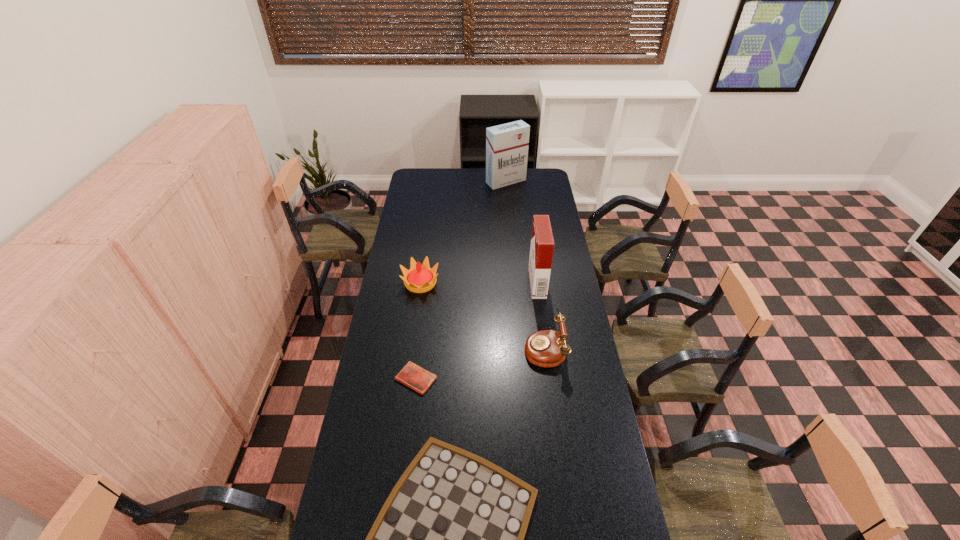
I want to click on vacant point located on the dial of the telephone, so click(474, 348).

Locate an element on the screen. This screenshot has width=960, height=540. vacant space located 0.180m on the dial of the telephone is located at coordinates (480, 348).

Where is `free region located 0.370m on the back of the crown`? The width and height of the screenshot is (960, 540). free region located 0.370m on the back of the crown is located at coordinates (429, 224).

Locate an element on the screen. The image size is (960, 540). free spot located 0.360m on the front of the diary is located at coordinates (401, 498).

In order to click on object positioned at the far edge in this screenshot , I will do `click(507, 144)`.

Find the location of a particular element. The height and width of the screenshot is (540, 960). crown that is at the left edge is located at coordinates (419, 278).

Identify the location of diary present at the left edge. The height and width of the screenshot is (540, 960). (415, 377).

The width and height of the screenshot is (960, 540). Find the location of `telephone located at the right edge`. telephone located at the right edge is located at coordinates (547, 348).

Identify the location of object located at the far right corner. The height and width of the screenshot is (540, 960). (507, 144).

The image size is (960, 540). Find the location of `vacant space at the far edge of the desktop`. vacant space at the far edge of the desktop is located at coordinates (463, 176).